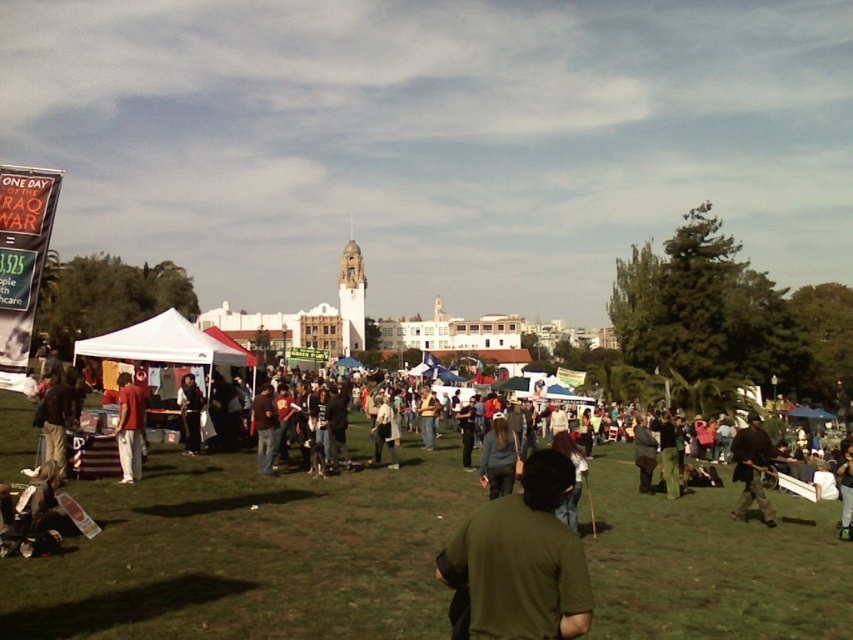
Can you confirm if green matte shirt at center is positioned above denim jacket at center?

Incorrect, green matte shirt at center is not positioned above denim jacket at center.

Can you confirm if green matte shirt at center is positioned below denim jacket at center?

Yes, green matte shirt at center is below denim jacket at center.

Who is more forward, (519, 552) or (422, 403)?

Positioned in front is point (519, 552).

This screenshot has width=853, height=640. I want to click on green matte shirt at center, so click(521, 561).

Does dark brown leather jacket at center appear under dark brown hair at center?

No.

Describe the element at coordinates (57, 419) in the screenshot. I see `dark brown leather jacket at center` at that location.

This screenshot has height=640, width=853. Find the location of `dark brown leather jacket at center`. dark brown leather jacket at center is located at coordinates (57, 419).

Which is above, green matte shirt at center or dark gray pants at center?

Positioned higher is dark gray pants at center.

Does point (537, 630) lie in front of point (397, 465)?

Yes, point (537, 630) is in front of point (397, 465).

This screenshot has width=853, height=640. Find the location of `green matte shirt at center`. green matte shirt at center is located at coordinates (521, 561).

What are the coordinates of `green matte shirt at center` in the screenshot? It's located at (521, 561).